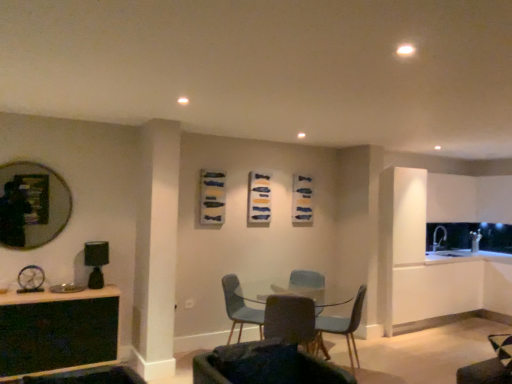
Question: Can you confirm if matte gray chair at center, which is the third chair from back to front, is taller than dark gray fabric chair at center, which ranks as the first chair in front-to-back order?

Choices:
 (A) no
 (B) yes

Answer: (B)

Question: From the image's perspective, is matte gray chair at center, the 2th chair from the front, over dark gray fabric chair at center, which ranks as the first chair in front-to-back order?

Choices:
 (A) yes
 (B) no

Answer: (B)

Question: From the image's perspective, is matte gray chair at center, which is the third chair from back to front, under dark gray fabric chair at center, which is counted as the 4th chair, starting from the back?

Choices:
 (A) no
 (B) yes

Answer: (B)

Question: Considering the relative positions of matte gray chair at center, which is the third chair from back to front, and dark gray fabric chair at center, which ranks as the first chair in front-to-back order, in the image provided, is matte gray chair at center, which is the third chair from back to front, to the left of dark gray fabric chair at center, which ranks as the first chair in front-to-back order, from the viewer's perspective?

Choices:
 (A) no
 (B) yes

Answer: (A)

Question: Is dark gray fabric chair at center, which ranks as the first chair in front-to-back order, at the back of matte gray chair at center, which is the third chair from back to front?

Choices:
 (A) no
 (B) yes

Answer: (B)

Question: Considering the positions of matte blue chair at center, the 2th chair when ordered from back to front, and matte gray chair at center, which is the third chair from back to front, in the image, is matte blue chair at center, the 2th chair when ordered from back to front, taller or shorter than matte gray chair at center, which is the third chair from back to front,?

Choices:
 (A) short
 (B) tall

Answer: (B)

Question: Is matte blue chair at center, the 2th chair when ordered from back to front, bigger or smaller than matte gray chair at center, which is the third chair from back to front?

Choices:
 (A) big
 (B) small

Answer: (A)

Question: Would you say matte blue chair at center, the 2th chair when ordered from back to front, is to the left or to the right of matte gray chair at center, the 2th chair from the front, in the picture?

Choices:
 (A) left
 (B) right

Answer: (B)

Question: Considering the positions of point (336, 332) and point (301, 327), is point (336, 332) closer or farther from the camera than point (301, 327)?

Choices:
 (A) farther
 (B) closer

Answer: (A)

Question: From a real-world perspective, is matte blue chair at center, which ranks as the third chair in front-to-back order, above or below clear glass table at center?

Choices:
 (A) below
 (B) above

Answer: (B)

Question: Is matte blue chair at center, which ranks as the third chair in front-to-back order, taller or shorter than clear glass table at center?

Choices:
 (A) short
 (B) tall

Answer: (B)

Question: Looking at their shapes, would you say matte blue chair at center, the 2th chair when ordered from back to front, is wider or thinner than clear glass table at center?

Choices:
 (A) wide
 (B) thin

Answer: (B)

Question: Would you say matte blue chair at center, which ranks as the third chair in front-to-back order, is inside or outside clear glass table at center?

Choices:
 (A) inside
 (B) outside

Answer: (A)

Question: Is matte gray chair at center, the 2th chair from the front, taller or shorter than matte blue chair at center, the 4th chair in the front-to-back sequence?

Choices:
 (A) tall
 (B) short

Answer: (B)

Question: From a real-world perspective, is matte gray chair at center, the 2th chair from the front, positioned above or below matte blue chair at center, the 4th chair in the front-to-back sequence?

Choices:
 (A) above
 (B) below

Answer: (A)